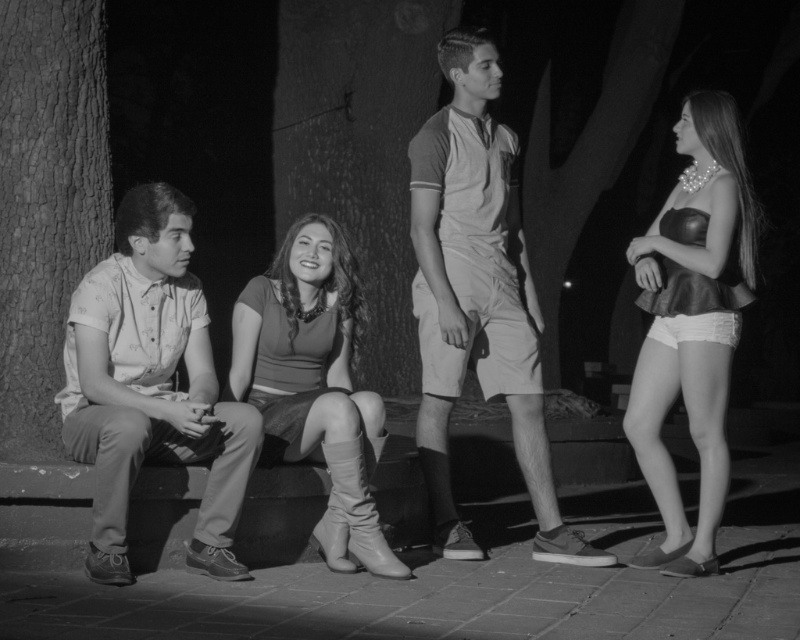
Is smooth bark tree at left above matte gray boots at center?

Correct, smooth bark tree at left is located above matte gray boots at center.

Which is more to the right, smooth bark tree at left or matte gray boots at center?

Positioned to the right is matte gray boots at center.

Does point (28, 122) come in front of point (258, 356)?

No, it is not.

The image size is (800, 640). Find the location of `smooth bark tree at left`. smooth bark tree at left is located at coordinates (48, 202).

Is smooth bark tree at left below leather skirt at right?

Incorrect, smooth bark tree at left is not positioned below leather skirt at right.

Does point (66, 250) come in front of point (684, 532)?

No, (66, 250) is behind (684, 532).

Between point (5, 193) and point (692, 294), which one is positioned behind?

The point (5, 193) is behind.

You are a GUI agent. You are given a task and a screenshot of the screen. Output one action in this format:
    pyautogui.click(x=<x>, y=<y>)
    Task: Click on the smooth bark tree at left
    This screenshot has width=800, height=640.
    Given the screenshot: What is the action you would take?
    coord(48,202)

Does light beige shorts at center appear on the right side of rough bark tree at center?

Indeed, light beige shorts at center is positioned on the right side of rough bark tree at center.

Does light beige shorts at center lie behind rough bark tree at center?

No, light beige shorts at center is closer to the viewer.

Is point (414, 234) more distant than point (424, 65)?

No, (414, 234) is closer to viewer.

This screenshot has height=640, width=800. I want to click on light beige shorts at center, so click(x=478, y=296).